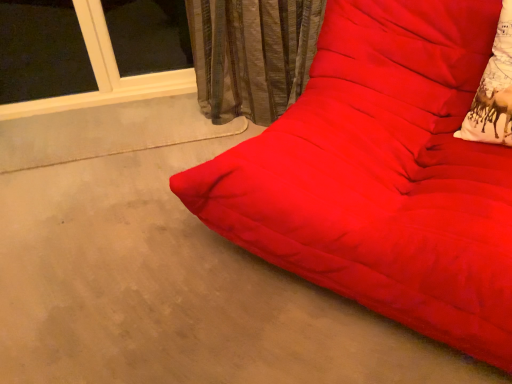
This screenshot has height=384, width=512. In order to click on white printed fabric at right in this screenshot , I will do `click(493, 91)`.

The width and height of the screenshot is (512, 384). What do you see at coordinates (493, 91) in the screenshot?
I see `white printed fabric at right` at bounding box center [493, 91].

Locate an element on the screen. The image size is (512, 384). matte red futon at center is located at coordinates (382, 175).

Describe the element at coordinates (382, 175) in the screenshot. Image resolution: width=512 pixels, height=384 pixels. I see `matte red futon at center` at that location.

Identify the location of white printed fabric at right. The width and height of the screenshot is (512, 384). (493, 91).

Can you confirm if matte red futon at center is positioned to the left of white printed fabric at right?

Correct, you'll find matte red futon at center to the left of white printed fabric at right.

From the picture: Between matte red futon at center and white printed fabric at right, which one is positioned behind?

white printed fabric at right is behind.

Which is less distant, (415, 184) or (478, 135)?

Point (415, 184) is positioned closer to the camera compared to point (478, 135).

From the image's perspective, does matte red futon at center appear lower than white printed fabric at right?

Yes, from the image's perspective, matte red futon at center is below white printed fabric at right.

From a real-world perspective, relative to white printed fabric at right, is matte red futon at center vertically above or below?

matte red futon at center is situated lower than white printed fabric at right in the real world.

Is matte red futon at center thinner than white printed fabric at right?

Incorrect, the width of matte red futon at center is not less than that of white printed fabric at right.

Considering the relative sizes of matte red futon at center and white printed fabric at right in the image provided, is matte red futon at center shorter than white printed fabric at right?

No, matte red futon at center is not shorter than white printed fabric at right.

Considering the relative sizes of matte red futon at center and white printed fabric at right in the image provided, is matte red futon at center smaller than white printed fabric at right?

No, matte red futon at center is not smaller than white printed fabric at right.

Would you say white printed fabric at right is part of matte red futon at center's contents?

Yes, white printed fabric at right is surrounded by matte red futon at center.

Is there a large distance between matte red futon at center and white printed fabric at right?

No, matte red futon at center is not far from white printed fabric at right.

Could you tell me if matte red futon at center is facing white printed fabric at right?

No.

Can you tell me how much matte red futon at center and white printed fabric at right differ in facing direction?

The angle between the facing direction of matte red futon at center and the facing direction of white printed fabric at right is 9.74 degrees.

Locate an element on the screen. The image size is (512, 384). throw pillow above the matte red futon at center (from a real-world perspective) is located at coordinates (493, 91).

In the scene shown: Which object is positioned more to the right, white printed fabric at right or matte red futon at center?

From the viewer's perspective, white printed fabric at right appears more on the right side.

Does white printed fabric at right come in front of matte red futon at center?

No, white printed fabric at right is further to the viewer.

Does point (510, 139) appear closer or farther from the camera than point (262, 190)?

Point (510, 139).

From the image's perspective, between white printed fabric at right and matte red futon at center, which one is located above?

white printed fabric at right appears higher in the image.

From a real-world perspective, is white printed fabric at right positioned over matte red futon at center based on gravity?

Yes.

Looking at their sizes, would you say white printed fabric at right is wider or thinner than matte red futon at center?

In the image, white printed fabric at right appears to be more narrow than matte red futon at center.

Considering the sizes of white printed fabric at right and matte red futon at center in the image, is white printed fabric at right taller or shorter than matte red futon at center?

Clearly, white printed fabric at right is shorter compared to matte red futon at center.

Based on the photo, considering the sizes of objects white printed fabric at right and matte red futon at center in the image provided, who is bigger, white printed fabric at right or matte red futon at center?

With larger size is matte red futon at center.

Is white printed fabric at right not within matte red futon at center?

That's incorrect, white printed fabric at right is not completely outside matte red futon at center.

Is white printed fabric at right placed right next to matte red futon at center?

white printed fabric at right and matte red futon at center are not in contact.

Does white printed fabric at right turn towards matte red futon at center?

Yes.

Locate an element on the screen. throw pillow lying behind the matte red futon at center is located at coordinates (493, 91).

Image resolution: width=512 pixels, height=384 pixels. I want to click on studio couch on the left of the white printed fabric at right, so click(x=382, y=175).

Where is `throw pillow above the matte red futon at center (from the image's perspective)`? The height and width of the screenshot is (384, 512). throw pillow above the matte red futon at center (from the image's perspective) is located at coordinates (493, 91).